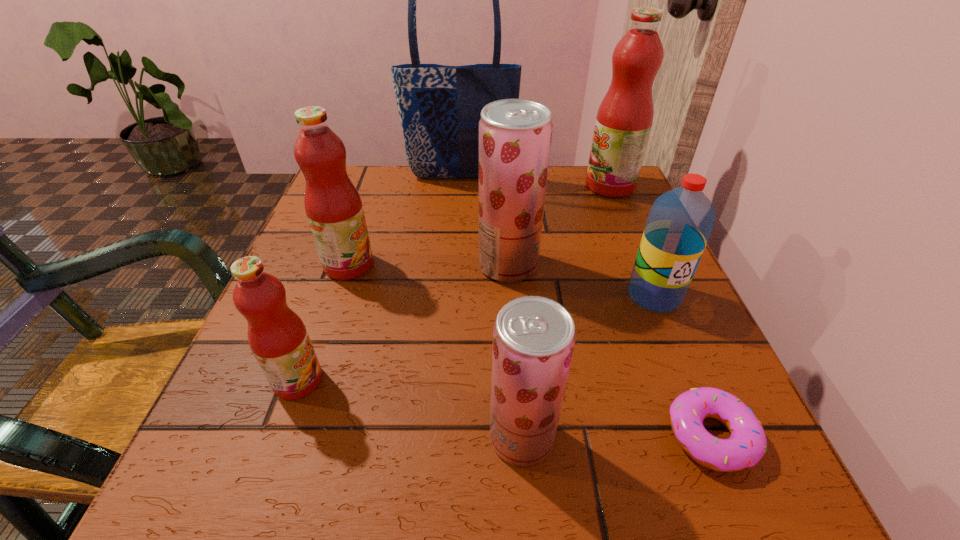
Locate an element on the screen. the tallest object is located at coordinates (440, 106).

The height and width of the screenshot is (540, 960). In order to click on the second tallest object in this screenshot , I will do `click(624, 119)`.

Identify the location of the rightmost fruit juice. The width and height of the screenshot is (960, 540). pyautogui.click(x=624, y=119).

Image resolution: width=960 pixels, height=540 pixels. Find the location of `the bigger strawberry fruit juice`. the bigger strawberry fruit juice is located at coordinates (515, 135).

The image size is (960, 540). Identify the location of the second farthest pink fruit juice. (333, 206).

Image resolution: width=960 pixels, height=540 pixels. Identify the location of red water bottle. (680, 222).

Locate an element on the screen. The image size is (960, 540). the nearest fruit juice is located at coordinates (533, 337).

Locate an element on the screen. the smaller strawberry fruit juice is located at coordinates (533, 337).

Locate an element on the screen. The image size is (960, 540). the nearest pink fruit juice is located at coordinates (277, 336).

Where is `the fourth farthest fruit juice`? the fourth farthest fruit juice is located at coordinates (277, 336).